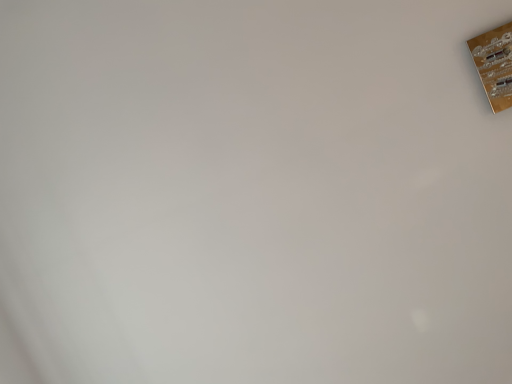
The height and width of the screenshot is (384, 512). Describe the element at coordinates (494, 65) in the screenshot. I see `wooden frame at upper right` at that location.

This screenshot has width=512, height=384. I want to click on wooden frame at upper right, so click(494, 65).

At what (x,y) coordinates should I click in order to perform the action: click on wooden frame at upper right. Please return your answer as a coordinate pair (x, y). Looking at the image, I should click on (494, 65).